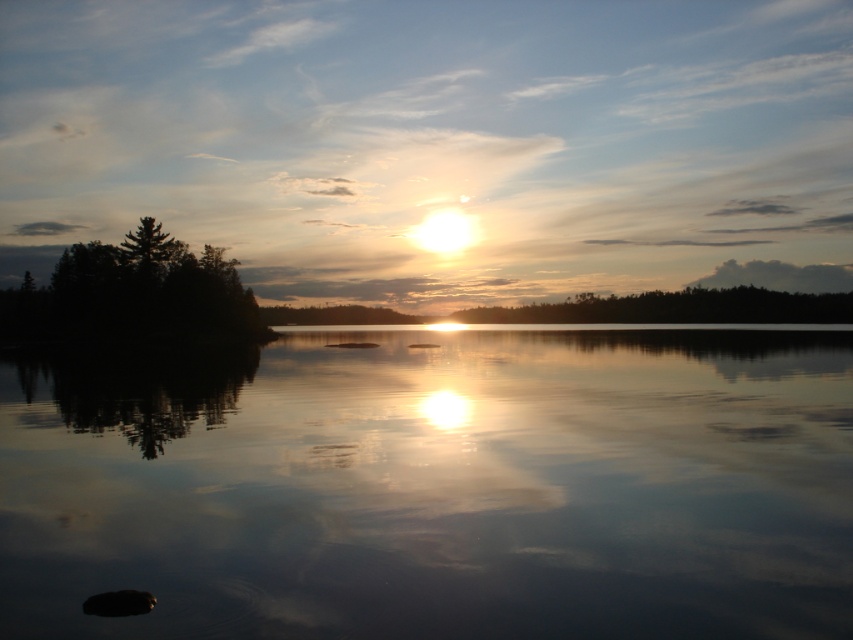
Measure the distance between transparent water at center and dark green textured tree at left.

transparent water at center and dark green textured tree at left are 48.52 meters apart from each other.

Between point (202, 484) and point (200, 292), which one is positioned in front?

Positioned in front is point (202, 484).

Identify the location of transparent water at center. The width and height of the screenshot is (853, 640). (438, 486).